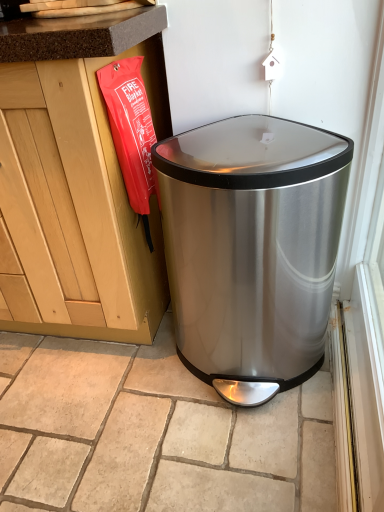
Question: Can you confirm if stainless steel trash can at lower right is shorter than beige stone tile at center?

Choices:
 (A) no
 (B) yes

Answer: (A)

Question: Is stainless steel trash can at lower right aimed at beige stone tile at center?

Choices:
 (A) yes
 (B) no

Answer: (B)

Question: Considering the relative sizes of stainless steel trash can at lower right and beige stone tile at center in the image provided, is stainless steel trash can at lower right taller than beige stone tile at center?

Choices:
 (A) no
 (B) yes

Answer: (B)

Question: From a real-world perspective, is stainless steel trash can at lower right beneath beige stone tile at center?

Choices:
 (A) yes
 (B) no

Answer: (B)

Question: Can you confirm if stainless steel trash can at lower right is thinner than beige stone tile at center?

Choices:
 (A) no
 (B) yes

Answer: (B)

Question: Is stainless steel trash can at lower right at the right side of beige stone tile at center?

Choices:
 (A) yes
 (B) no

Answer: (A)

Question: Is the position of beige stone tile at center less distant than that of stainless steel trash can at lower right?

Choices:
 (A) yes
 (B) no

Answer: (B)

Question: Is beige stone tile at center facing towards stainless steel trash can at lower right?

Choices:
 (A) no
 (B) yes

Answer: (A)

Question: Is beige stone tile at center not near stainless steel trash can at lower right?

Choices:
 (A) yes
 (B) no

Answer: (B)

Question: Considering the relative sizes of beige stone tile at center and stainless steel trash can at lower right in the image provided, is beige stone tile at center taller than stainless steel trash can at lower right?

Choices:
 (A) no
 (B) yes

Answer: (A)

Question: Is beige stone tile at center completely or partially outside of stainless steel trash can at lower right?

Choices:
 (A) no
 (B) yes

Answer: (B)

Question: Considering the relative positions of beige stone tile at center and stainless steel trash can at lower right in the image provided, is beige stone tile at center behind stainless steel trash can at lower right?

Choices:
 (A) no
 (B) yes

Answer: (B)

Question: Considering the positions of beige stone tile at center and stainless steel trash can at lower right in the image, is beige stone tile at center bigger or smaller than stainless steel trash can at lower right?

Choices:
 (A) small
 (B) big

Answer: (A)